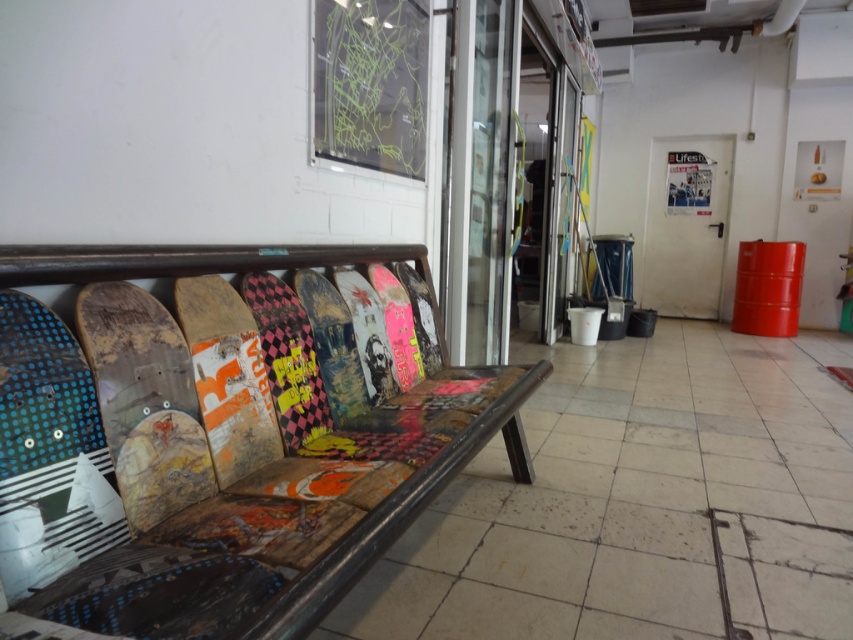
Describe the element at coordinates (288, 358) in the screenshot. I see `checkered matte skateboard at center` at that location.

Who is taller, checkered matte skateboard at center or multi-colored painted skateboard at center?

checkered matte skateboard at center

Locate an element on the screen. This screenshot has height=640, width=853. checkered matte skateboard at center is located at coordinates (288, 358).

Is point (123, 504) farther from viewer compared to point (374, 292)?

No.

The height and width of the screenshot is (640, 853). I want to click on wooden skateboard at left, so [144, 401].

Does wooden skateboard bench at left appear on the left side of matte black map at upper center?

No, wooden skateboard bench at left is not to the left of matte black map at upper center.

Who is taller, wooden skateboard bench at left or matte black map at upper center?

Standing taller between the two is wooden skateboard bench at left.

Which is behind, point (131, 625) or point (374, 10)?

Point (374, 10)

Identify the location of wooden skateboard bench at left. (242, 451).